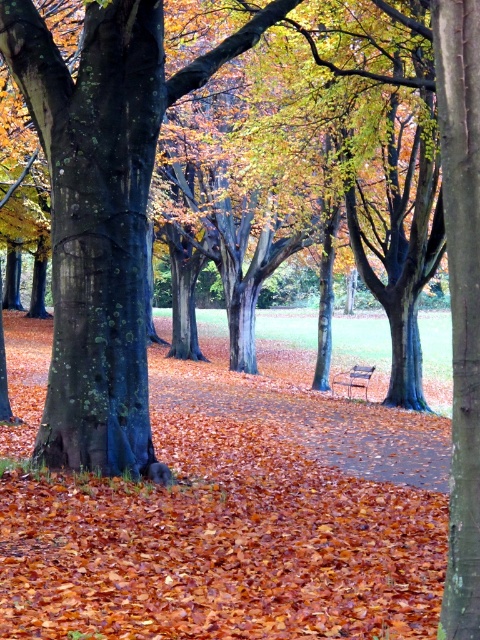
You are a painter setting up your easel in the center of the park. You want to paint both the smooth bark tree at center and the wooden park bench at center. Which object should you place closer to your easel to ensure both fit in your painting?

The smooth bark tree at center is smaller than the wooden park bench at center, so you should place the wooden park bench at center closer to your easel to ensure both fit in your painting.

You are a photographer trying to capture a photo of the smooth bark tree at center and the wooden park bench at center. Since you want both objects to be clearly visible in the frame, which one should you focus on first to ensure proper depth of field?

The smooth bark tree at center is much taller than the wooden park bench at center, so you should focus on the smooth bark tree at center first to ensure both are in focus.

You are standing in the autumn scene and notice two points marked in the image. The first point is at coordinates point (444, 147) and the second is at point (360, 376). Which point is nearer to you?

Point (444, 147) is closer to the viewer than point (360, 376).